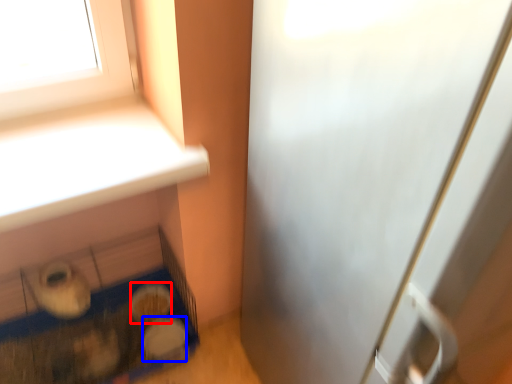
Question: Which object appears closest to the camera in this image, food (highlighted by a red box) or food (highlighted by a blue box)?

Choices:
 (A) food
 (B) food

Answer: (B)